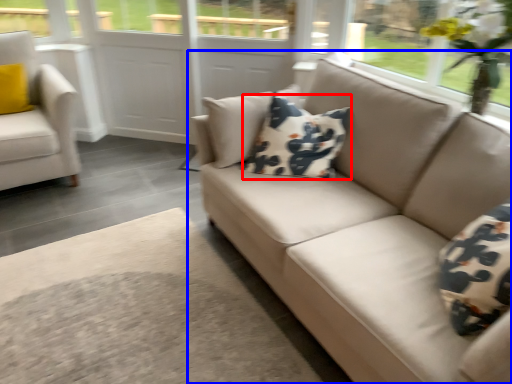
Question: Which object appears farthest to the camera in this image, pillow (highlighted by a red box) or studio couch (highlighted by a blue box)?

Choices:
 (A) pillow
 (B) studio couch

Answer: (A)